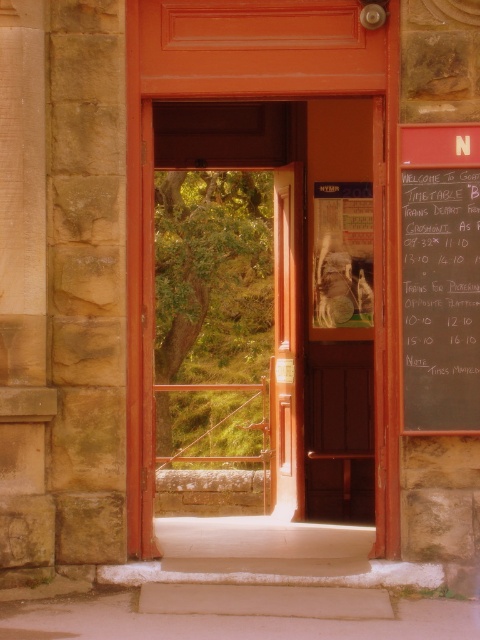
You are an interior designer planning to install a new door and a chalkboard in a similar stone wall setup. Given the current scene, which object is wider between the wooden door at center and the black chalkboard at right?

The wooden door at center is wider than the black chalkboard at right according to the description.

You are an interior designer planning to place a decorative mirror next to the wooden door at center. The mirror must be smaller than the door but larger than the black chalkboard at right. Is this possible?

The wooden door at center is bigger than the black chalkboard at right. Since the mirror needs to be smaller than the door but larger than the chalkboard, it is possible as long as the mirror is sized between the two objects.

You are standing 20 feet away from the wooden door at center. You want to reach the door. How many steps do you need to take if each step is 1 foot long?

The wooden door at center is 20.86 feet away from you. Since each step is 1 foot long, you need to take 21 steps to reach the door.